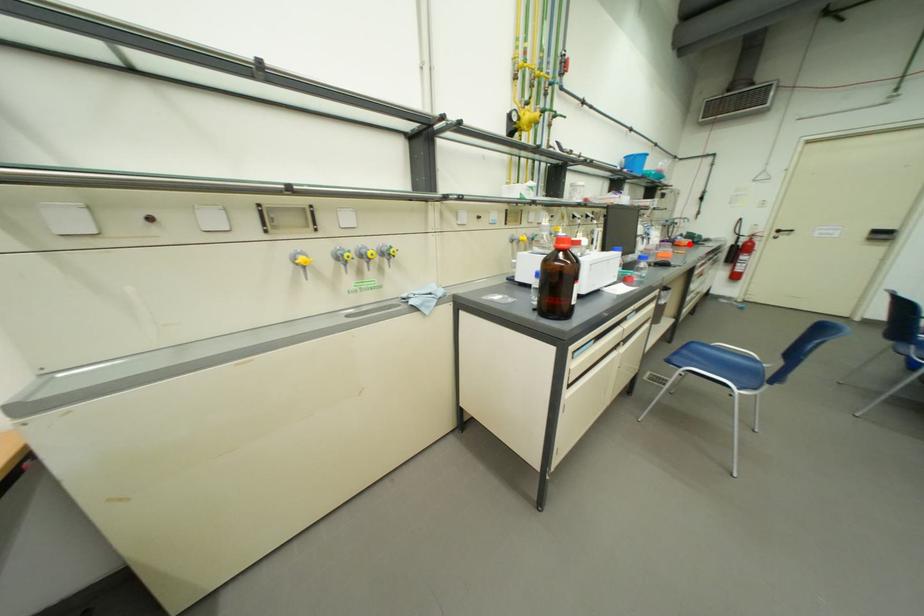
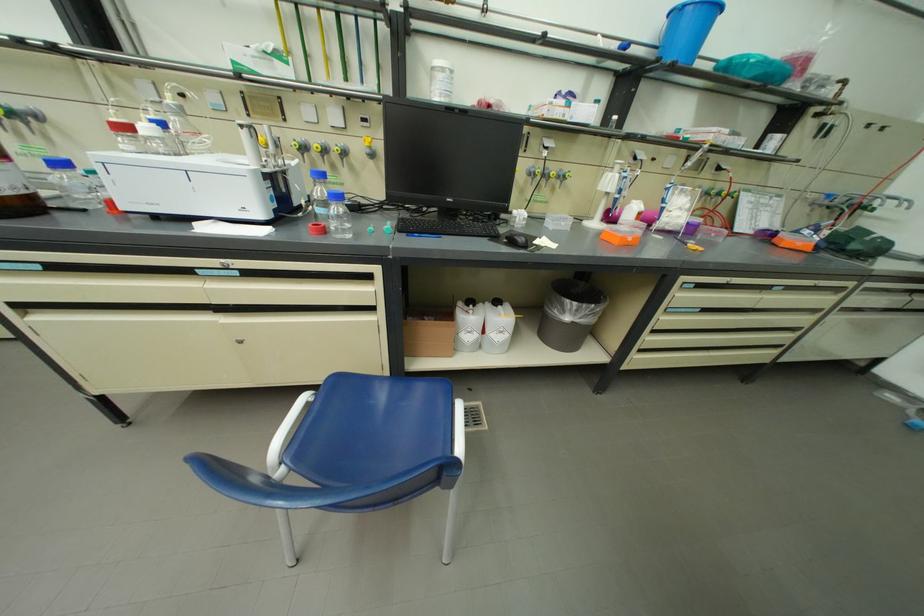
Where in the second image is the point corresponding to the highlighted location from the first image?

(793, 241)